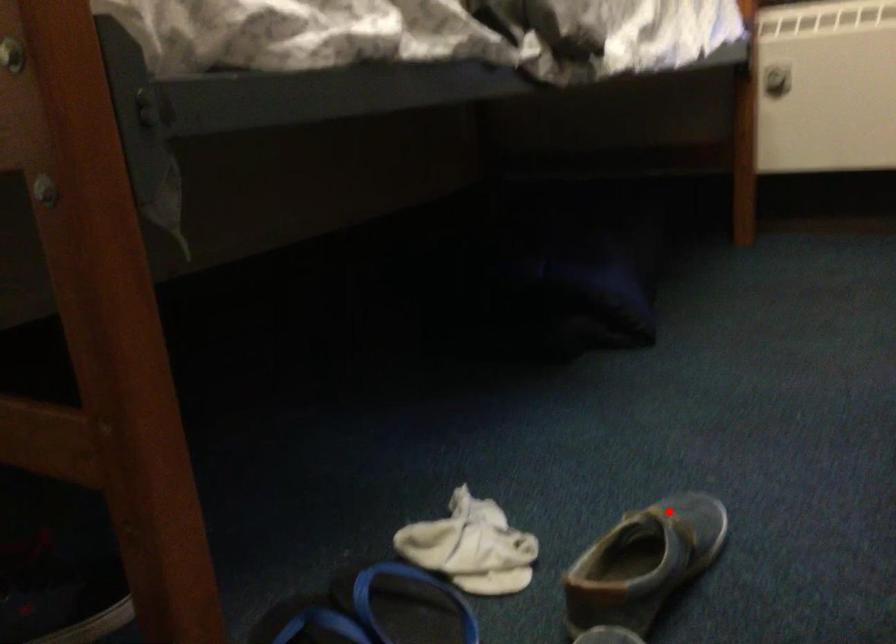
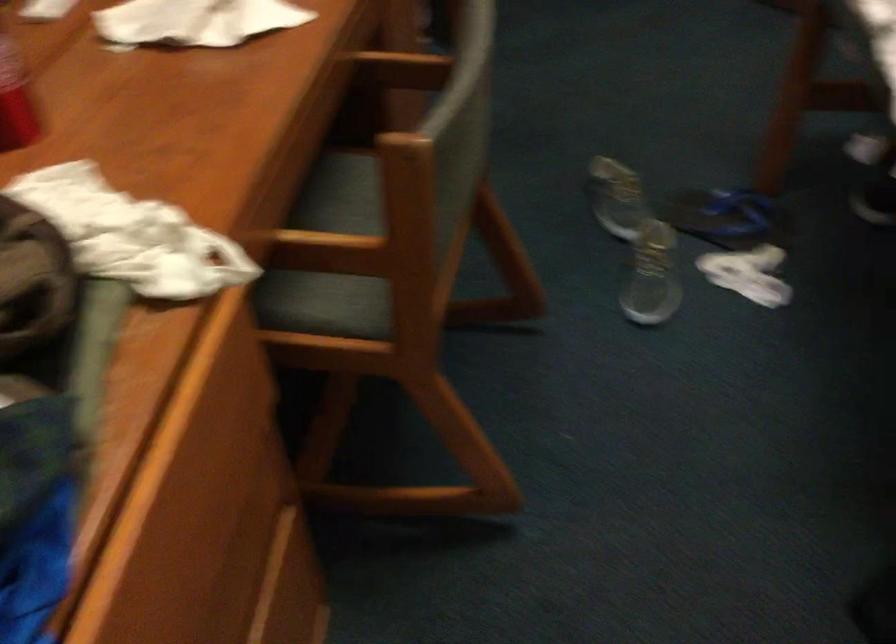
Locate, in the second image, the point that corresponds to the highlighted location in the first image.

(650, 287)